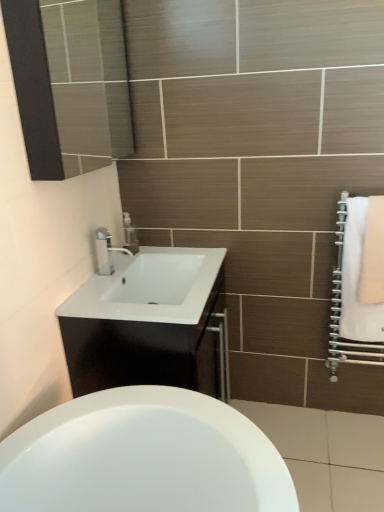
Find the location of a particular element. The height and width of the screenshot is (512, 384). free space underneath black glass mirror at upper left (from a real-world perspective) is located at coordinates (106, 275).